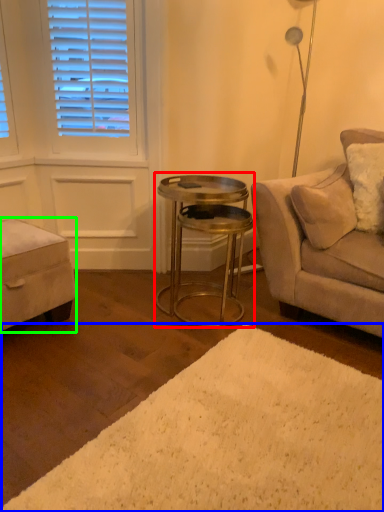
Question: Based on their relative distances, which object is nearer to table (highlighted by a red box)? Choose from plain (highlighted by a blue box) and music stool (highlighted by a green box).

Choices:
 (A) plain
 (B) music stool

Answer: (B)